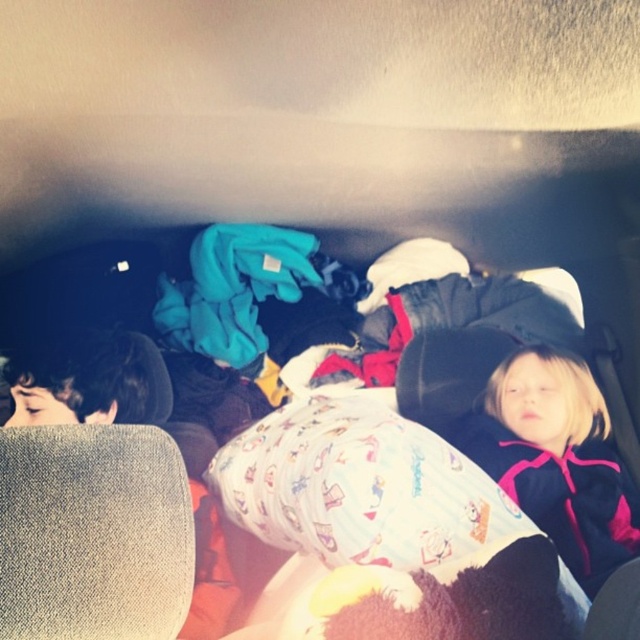
You are a parent trying to place a 20 inch long stuffed animal between the white cotton bed at center and the pink fleece jacket at right in the backseat of the car. Will the stuffed animal fit between them without overlapping either object?

The white cotton bed at center and the pink fleece jacket at right are 19.47 inches apart from each other. Since the stuffed animal is 20 inches long, it will not fit between them without overlapping because the distance is slightly less than the required space.

You are a parent trying to ensure your children are comfortable in the car. You have a white cotton bed at center and dark brown hair at left in the backseat. Can you determine if there is enough space between them for both children to move comfortably? The recommended minimum distance for comfort is 18 inches.

The white cotton bed at center and dark brown hair at left are 20.26 inches apart from each other, which exceeds the recommended minimum distance of 18 inches. Therefore, there is enough space between them for both children to move comfortably.